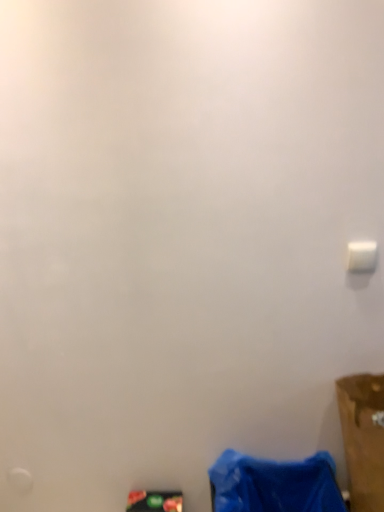
Question: Is blue fabric bag at lower right, acting as the second waste starting from the left, to the left of white plastic light switch at upper right from the viewer's perspective?

Choices:
 (A) yes
 (B) no

Answer: (A)

Question: Can you confirm if blue fabric bag at lower right, the first waste when ordered from right to left, is positioned to the right of white plastic light switch at upper right?

Choices:
 (A) no
 (B) yes

Answer: (A)

Question: Considering the relative sizes of blue fabric bag at lower right, the first waste when ordered from right to left, and white plastic light switch at upper right in the image provided, is blue fabric bag at lower right, the first waste when ordered from right to left, thinner than white plastic light switch at upper right?

Choices:
 (A) no
 (B) yes

Answer: (A)

Question: From a real-world perspective, is blue fabric bag at lower right, the first waste when ordered from right to left, physically below white plastic light switch at upper right?

Choices:
 (A) no
 (B) yes

Answer: (B)

Question: Is blue fabric bag at lower right, acting as the second waste starting from the left, beside white plastic light switch at upper right?

Choices:
 (A) yes
 (B) no

Answer: (B)

Question: In the image, is white plastic light switch at upper right on the left side or the right side of brown cardboard box at lower right?

Choices:
 (A) right
 (B) left

Answer: (B)

Question: Is white plastic light switch at upper right taller or shorter than brown cardboard box at lower right?

Choices:
 (A) tall
 (B) short

Answer: (B)

Question: Which is correct: white plastic light switch at upper right is inside brown cardboard box at lower right, or outside of it?

Choices:
 (A) inside
 (B) outside

Answer: (B)

Question: From the image's perspective, is white plastic light switch at upper right above or below brown cardboard box at lower right?

Choices:
 (A) above
 (B) below

Answer: (A)

Question: Is matte black phone at lower center, which ranks as the 2th waste in right-to-left order, spatially inside blue fabric bag at lower right, acting as the second waste starting from the left, or outside of it?

Choices:
 (A) inside
 (B) outside

Answer: (B)

Question: From a real-world perspective, is matte black phone at lower center, placed as the 1th waste when sorted from left to right, physically located above or below blue fabric bag at lower right, acting as the second waste starting from the left?

Choices:
 (A) below
 (B) above

Answer: (A)

Question: Considering the positions of matte black phone at lower center, placed as the 1th waste when sorted from left to right, and blue fabric bag at lower right, the first waste when ordered from right to left, in the image, is matte black phone at lower center, placed as the 1th waste when sorted from left to right, taller or shorter than blue fabric bag at lower right, the first waste when ordered from right to left,?

Choices:
 (A) short
 (B) tall

Answer: (B)

Question: From the image's perspective, is matte black phone at lower center, placed as the 1th waste when sorted from left to right, positioned above or below blue fabric bag at lower right, the first waste when ordered from right to left?

Choices:
 (A) above
 (B) below

Answer: (B)

Question: In terms of size, does matte black phone at lower center, which ranks as the 2th waste in right-to-left order, appear bigger or smaller than white plastic light switch at upper right?

Choices:
 (A) big
 (B) small

Answer: (A)

Question: Based on their positions, is matte black phone at lower center, which ranks as the 2th waste in right-to-left order, located to the left or right of white plastic light switch at upper right?

Choices:
 (A) left
 (B) right

Answer: (A)